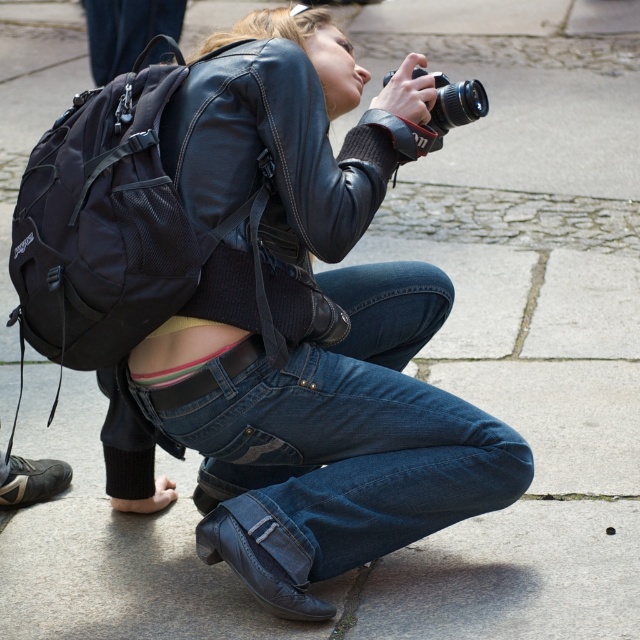
Between denim at center and black matte camera at upper center, which one has less height?

Standing shorter between the two is black matte camera at upper center.

In the scene shown: Who is positioned more to the left, denim at center or black matte camera at upper center?

denim at center

Measure the distance between point (388,280) and camera.

Point (388,280) and camera are 3.73 meters apart from each other.

Identify the location of denim at center. (340, 435).

Consider the image. Who is shorter, black mesh backpack at upper left or black matte camera at upper center?

black matte camera at upper center is shorter.

Does black mesh backpack at upper left appear under black matte camera at upper center?

Correct, black mesh backpack at upper left is located below black matte camera at upper center.

Locate an element on the screen. black mesh backpack at upper left is located at coordinates (115, 228).

Where is `black mesh backpack at upper left`? The width and height of the screenshot is (640, 640). black mesh backpack at upper left is located at coordinates (115, 228).

Can you confirm if denim at center is positioned below black mesh backpack at upper left?

Indeed, denim at center is positioned under black mesh backpack at upper left.

Does denim at center have a greater width compared to black mesh backpack at upper left?

Indeed, denim at center has a greater width compared to black mesh backpack at upper left.

Find the location of a particular element. denim at center is located at coordinates point(340,435).

Locate an element on the screen. This screenshot has height=640, width=640. denim at center is located at coordinates (340, 435).